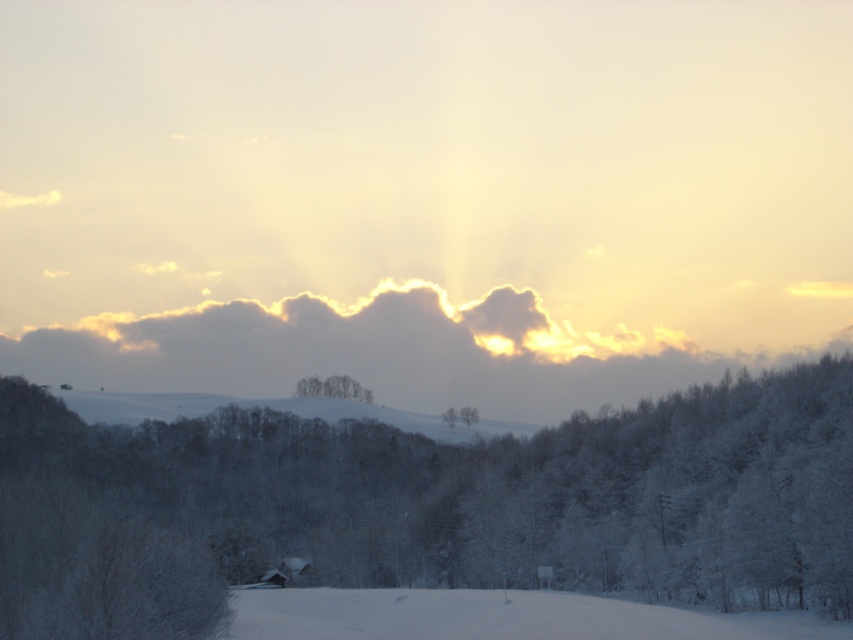
Does white powdery snow at lower center come in front of white snow-covered trees at center?

Yes, white powdery snow at lower center is in front of white snow-covered trees at center.

Locate an element on the screen. white powdery snow at lower center is located at coordinates (495, 616).

Does point (363, 618) come in front of point (300, 381)?

That is True.

Where is `white powdery snow at lower center`? white powdery snow at lower center is located at coordinates (495, 616).

From the picture: Can you confirm if white frosty tree at center is positioned above white powdery snow at lower center?

Yes, white frosty tree at center is above white powdery snow at lower center.

Who is positioned more to the left, white frosty tree at center or white powdery snow at lower center?

From the viewer's perspective, white frosty tree at center appears more on the left side.

Image resolution: width=853 pixels, height=640 pixels. What do you see at coordinates (430, 506) in the screenshot? I see `white frosty tree at center` at bounding box center [430, 506].

Where is `white frosty tree at center`? white frosty tree at center is located at coordinates point(430,506).

Consider the image. Can you confirm if white frosty tree at center is shorter than white snow-covered trees at center?

In fact, white frosty tree at center may be taller than white snow-covered trees at center.

Which is above, white frosty tree at center or white snow-covered trees at center?

white snow-covered trees at center

Locate an element on the screen. The height and width of the screenshot is (640, 853). white frosty tree at center is located at coordinates (430, 506).